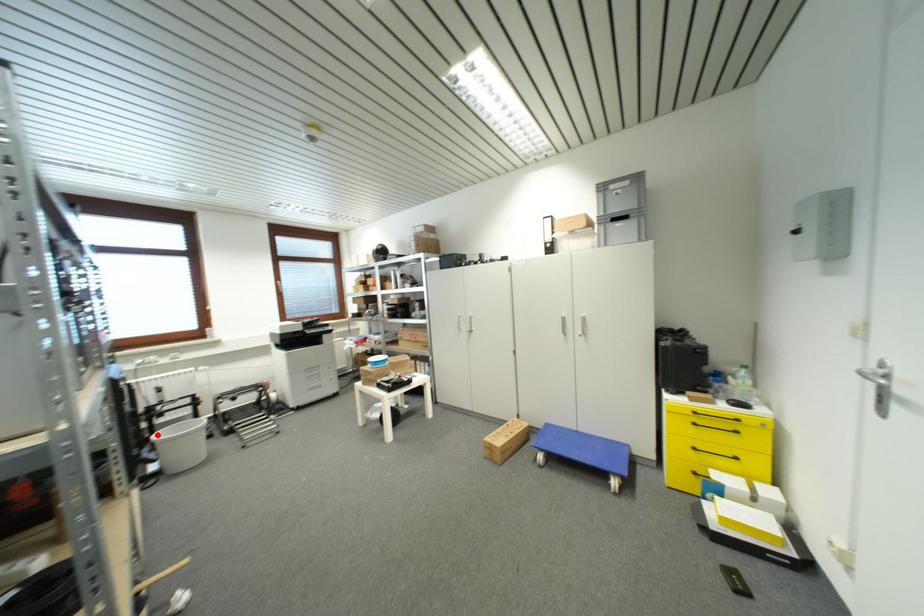
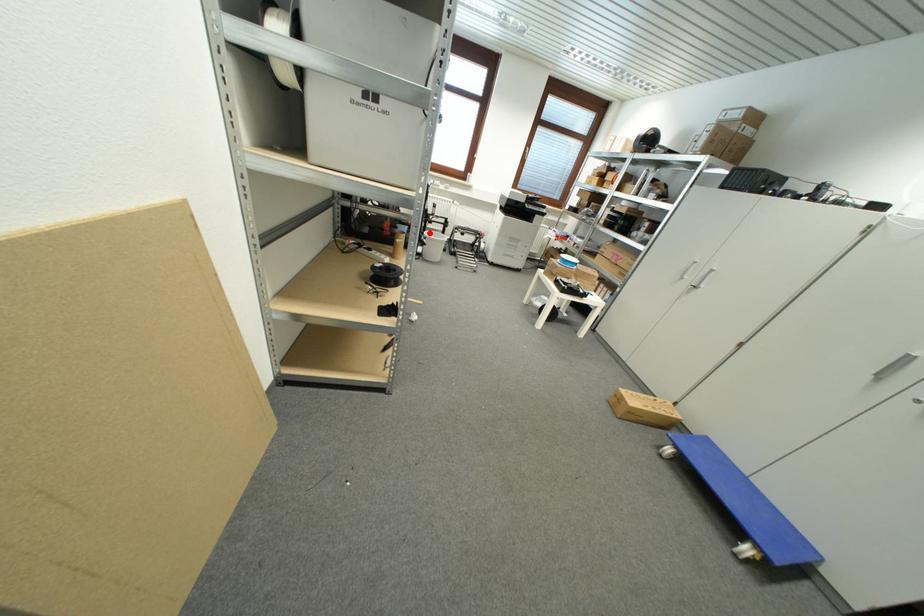
I am providing you with two images of the same scene from different viewpoints. A red point is marked on the first image and another point is marked on the second image. Do the highlighted points in image1 and image2 indicate the same real-world spot?

Yes